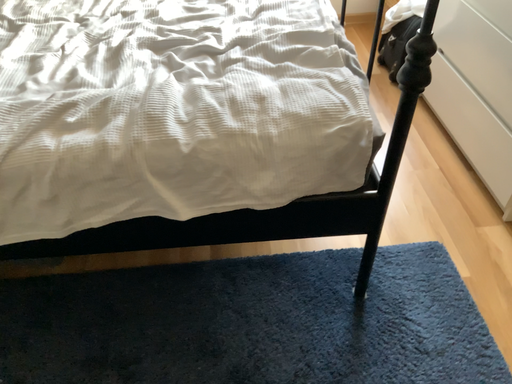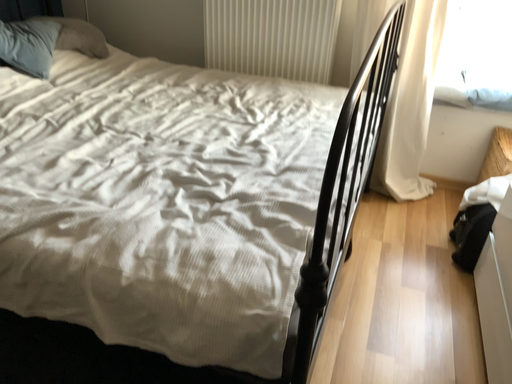
Question: How did the camera likely rotate when shooting the video?

Choices:
 (A) rotated right
 (B) rotated left

Answer: (B)